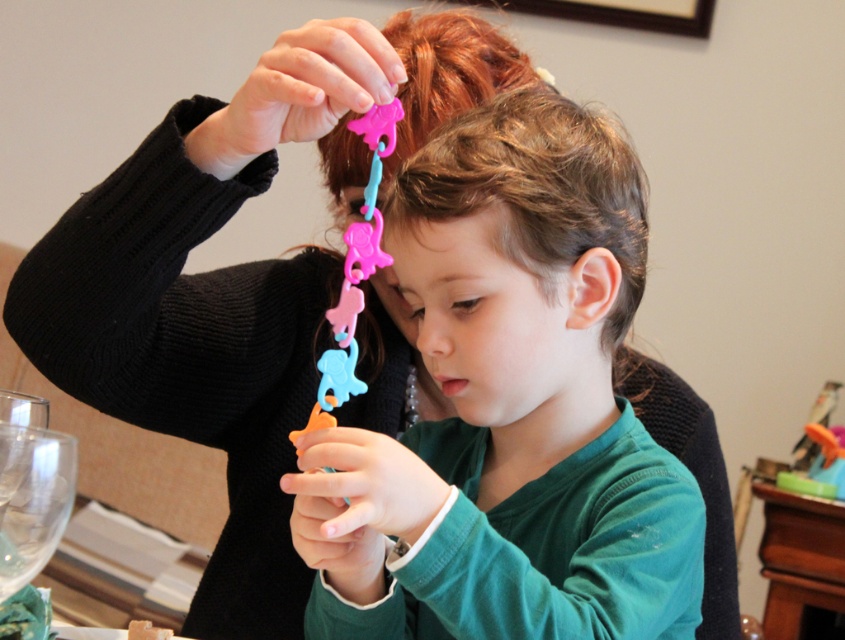
You are a parent trying to help your child with a craft project. You see the matte plastic toy at center and the brown matte hair at center. Which object is located below the other?

The matte plastic toy at center is positioned under brown matte hair at center.

You are a robot trying to locate the matte plastic toy at center in a 2D coordinate system where the bottom left corner is the origin. What are its coordinates?

The coordinates of the matte plastic toy at center are at point (x=510, y=408).

You are a toy designer observing the scene. You need to determine which object is taller between the brown matte hair at center and the translucent plastic toy at lower right. Based on the scene, which one is taller?

The brown matte hair at center has a greater height compared to the translucent plastic toy at lower right, so the brown matte hair at center is taller.